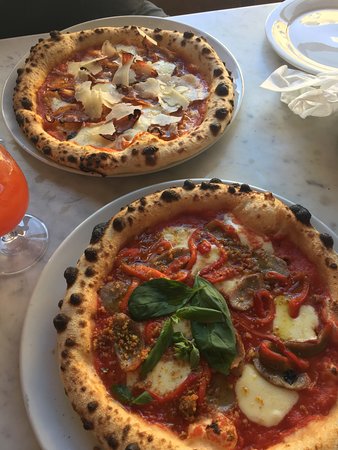
Where is `napkin`? napkin is located at coordinates (317, 105).